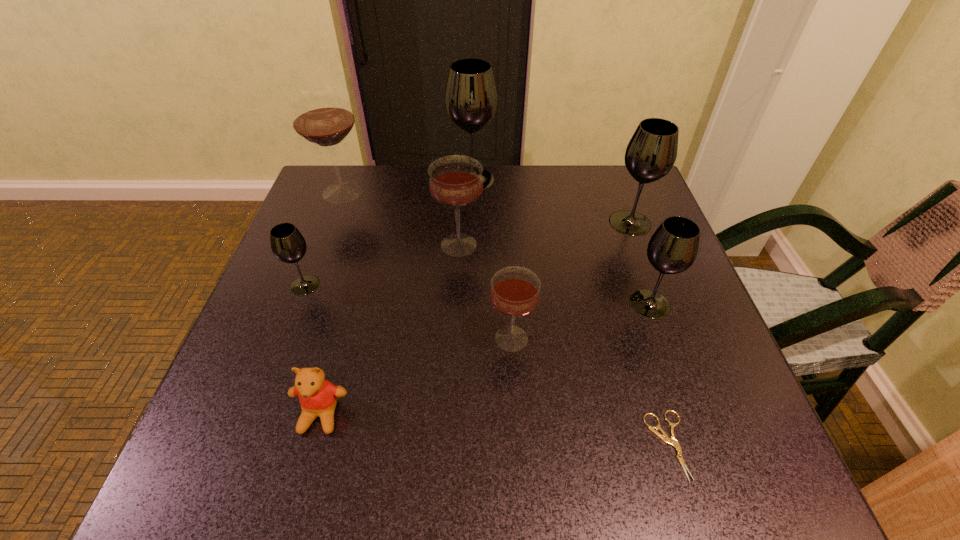
Locate an element on the screen. unoccupied position between the second biggest gray wineglass and the shears is located at coordinates (649, 334).

Locate an element on the screen. free point between the smallest gray wineglass and the tallest wineglass is located at coordinates (389, 232).

The height and width of the screenshot is (540, 960). Find the location of `unoccupied position between the seventh farthest object and the second red wineglass from right to left`. unoccupied position between the seventh farthest object and the second red wineglass from right to left is located at coordinates (485, 292).

Where is `empty space between the farthest gray wineglass and the third biggest gray wineglass`? Image resolution: width=960 pixels, height=540 pixels. empty space between the farthest gray wineglass and the third biggest gray wineglass is located at coordinates (562, 241).

In order to click on vacant space that is in between the second biggest red wineglass and the nearest wineglass in this screenshot , I will do `click(485, 292)`.

Locate an element on the screen. The width and height of the screenshot is (960, 540). empty space between the smallest red wineglass and the beige shears is located at coordinates (590, 392).

Locate an element on the screen. blank region between the smallest red wineglass and the biggest red wineglass is located at coordinates pos(427,265).

The height and width of the screenshot is (540, 960). In order to click on the fourth closest object to the third gray wineglass from right to left in this screenshot , I will do `click(288, 245)`.

The height and width of the screenshot is (540, 960). In order to click on object that ranks as the third closest to the shears in this screenshot , I will do `click(455, 182)`.

Point out which wineglass is positioned as the fifth nearest to the biggest gray wineglass. Please provide its 2D coordinates. Your answer should be formatted as a tuple, i.e. [(x, y)], where the tuple contains the x and y coordinates of a point satisfying the conditions above.

[(515, 291)]